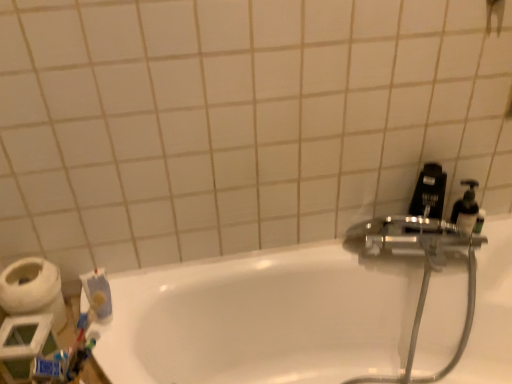
Question: Is shiny metallic hose at upper right to the left or to the right of blue matte toothpaste at lower left in the image?

Choices:
 (A) left
 (B) right

Answer: (B)

Question: Is shiny metallic hose at upper right inside the boundaries of blue matte toothpaste at lower left, or outside?

Choices:
 (A) inside
 (B) outside

Answer: (B)

Question: Which object is the closest to the white glossy bathtub at center?

Choices:
 (A) white matte toilet paper at lower left
 (B) shiny metallic hose at upper right
 (C) blue matte toothpaste at lower left
 (D) black plastic soap dispenser at right

Answer: (B)

Question: Based on their relative distances, which object is nearer to the white glossy bathtub at center?

Choices:
 (A) blue matte toothpaste at lower left
 (B) white matte toilet paper at lower left
 (C) shiny metallic hose at upper right
 (D) black plastic soap dispenser at right

Answer: (C)